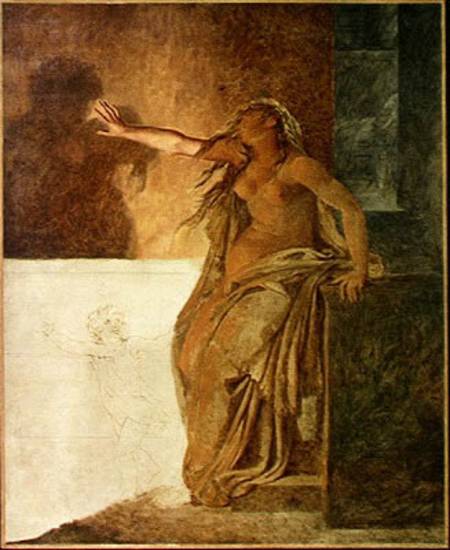
Locate an element on the screen. The height and width of the screenshot is (550, 450). floor is located at coordinates (159, 520), (249, 531).